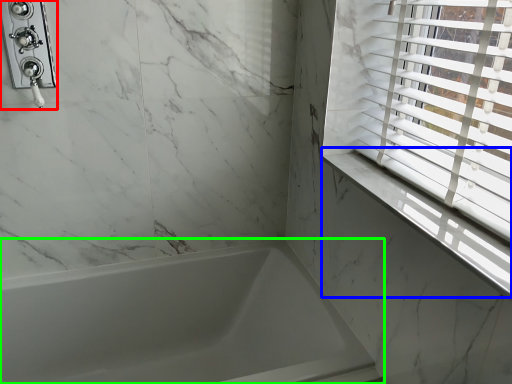
Question: Based on their relative distances, which object is farther from shower (highlighted by a red box)? Choose from window sill (highlighted by a blue box) and bathtub (highlighted by a green box).

Choices:
 (A) window sill
 (B) bathtub

Answer: (A)